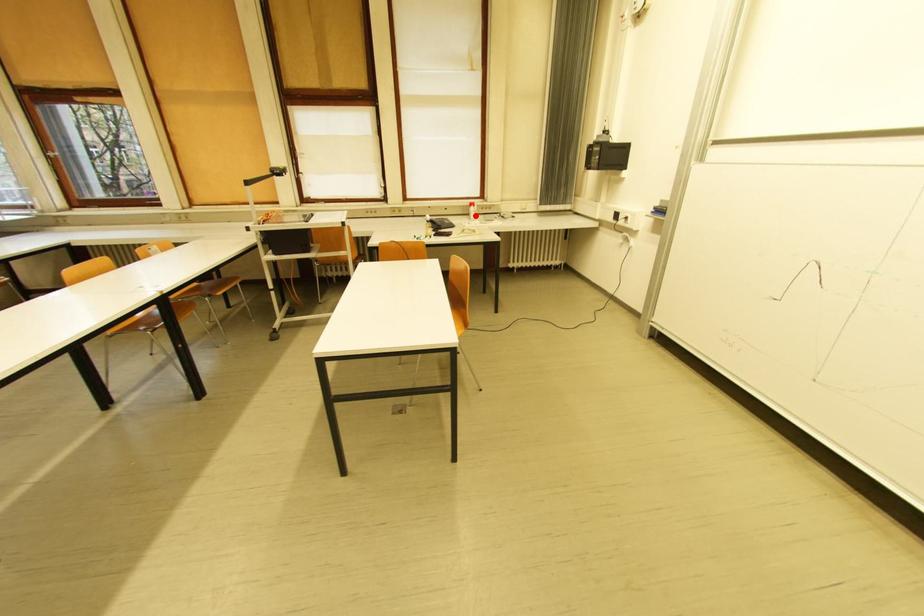
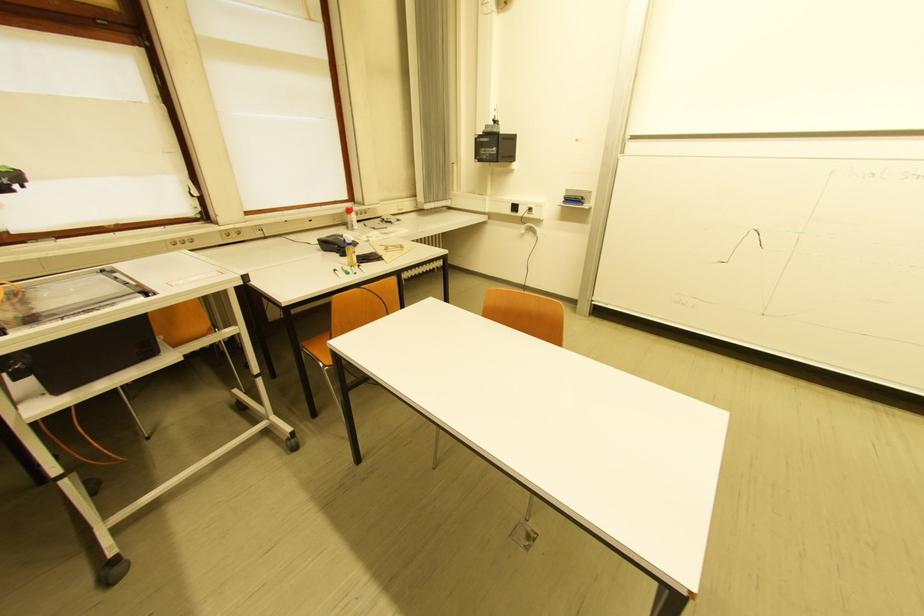
Question: I am providing you with two images of the same scene from different viewpoints. A red point is marked on the first image. At the location where the point appears in image 1, is it still visible in image 2?

Choices:
 (A) Yes
 (B) No

Answer: (A)